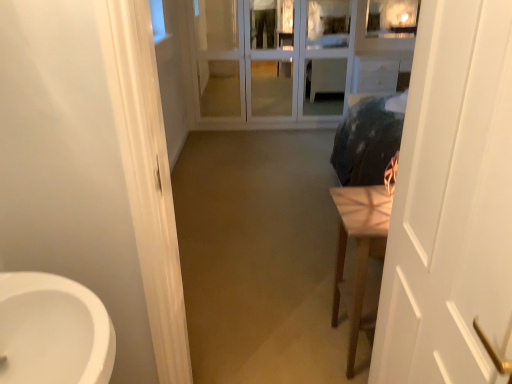
What are the coordinates of `light brown wooden table at right` in the screenshot? It's located at (360, 256).

Where is `white glass screen door at center`? The height and width of the screenshot is (384, 512). white glass screen door at center is located at coordinates (269, 59).

Between white matte door at right and white glass screen door at center, which one appears on the right side from the viewer's perspective?

From the viewer's perspective, white matte door at right appears more on the right side.

From a real-world perspective, which object rests below the other?

From a 3D spatial view, white glass screen door at center is below.

Is white matte door at right facing away from white glass screen door at center?

white matte door at right does not have its back to white glass screen door at center.

From the image's perspective, relative to white glass screen door at center, is white matte door at right above or below?

From the image's perspective, white matte door at right appears below white glass screen door at center.

In the image, there is a light brown wooden table at right. Identify the location of door above it (from the image's perspective). (451, 203).

Between white matte door at right and light brown wooden table at right, which one has smaller size?

Smaller between the two is white matte door at right.

Consider the image. Looking at their sizes, would you say white matte door at right is wider or thinner than light brown wooden table at right?

In the image, white matte door at right appears to be more narrow than light brown wooden table at right.

In terms of height, does light brown wooden table at right look taller or shorter compared to white matte door at right?

Clearly, light brown wooden table at right is shorter compared to white matte door at right.

Could you tell me if light brown wooden table at right is facing white matte door at right?

No.

Is light brown wooden table at right beside white matte door at right?

No, light brown wooden table at right is not with white matte door at right.

At what (x,y) coordinates should I click in order to perform the action: click on furniture below the white matte door at right (from a real-world perspective). Please return your answer as a coordinate pair (x, y). Looking at the image, I should click on (360, 256).

Is white glass screen door at center looking in the opposite direction of white matte door at right?

No, white glass screen door at center is not facing away from white matte door at right.

This screenshot has width=512, height=384. What are the coordinates of `door in front of the white glass screen door at center` in the screenshot? It's located at (451, 203).

Is white glass screen door at center bigger or smaller than white matte door at right?

white glass screen door at center is bigger than white matte door at right.

From a real-world perspective, which object stands above the other?

white glass screen door at center, from a real-world perspective.

Considering the sizes of objects light brown wooden table at right and white glass screen door at center in the image provided, who is bigger, light brown wooden table at right or white glass screen door at center?

white glass screen door at center is bigger.

Is light brown wooden table at right positioned beyond the bounds of white glass screen door at center?

That's correct, light brown wooden table at right is outside of white glass screen door at center.

Who is taller, light brown wooden table at right or white glass screen door at center?

white glass screen door at center is taller.

Considering the relative sizes of white glass screen door at center and light brown wooden table at right in the image provided, is white glass screen door at center smaller than light brown wooden table at right?

Actually, white glass screen door at center might be larger than light brown wooden table at right.

From a real-world perspective, is white glass screen door at center located beneath light brown wooden table at right?

No.

Identify the location of screen door to the left of light brown wooden table at right. Image resolution: width=512 pixels, height=384 pixels. (269, 59).

Is white glass screen door at center to the left or to the right of light brown wooden table at right in the image?

From the image, it's evident that white glass screen door at center is to the left of light brown wooden table at right.

Where is `screen door above the white matte door at right (from the image's perspective)`? The image size is (512, 384). screen door above the white matte door at right (from the image's perspective) is located at coordinates (269, 59).

The image size is (512, 384). I want to click on door on the left of light brown wooden table at right, so coord(451,203).

From the image, which object appears to be nearer to white glass screen door at center, white matte door at right or light brown wooden table at right?

Based on the image, light brown wooden table at right appears to be nearer to white glass screen door at center.

Which object lies further to the anchor point light brown wooden table at right, white glass screen door at center or white matte door at right?

Among the two, white glass screen door at center is located further to light brown wooden table at right.

From the image, which object appears to be nearer to white glass screen door at center, light brown wooden table at right or white matte door at right?

light brown wooden table at right lies closer to white glass screen door at center than the other object.

Estimate the real-world distances between objects in this image. Which object is closer to white matte door at right, light brown wooden table at right or white glass screen door at center?

light brown wooden table at right lies closer to white matte door at right than the other object.

Considering their positions, is white glass screen door at center positioned closer to white matte door at right than light brown wooden table at right?

light brown wooden table at right.

Looking at the image, which one is located further to light brown wooden table at right, white matte door at right or white glass screen door at center?

Among the two, white glass screen door at center is located further to light brown wooden table at right.

Where is `furniture between white matte door at right and white glass screen door at center from front to back`? This screenshot has height=384, width=512. furniture between white matte door at right and white glass screen door at center from front to back is located at coordinates (360, 256).